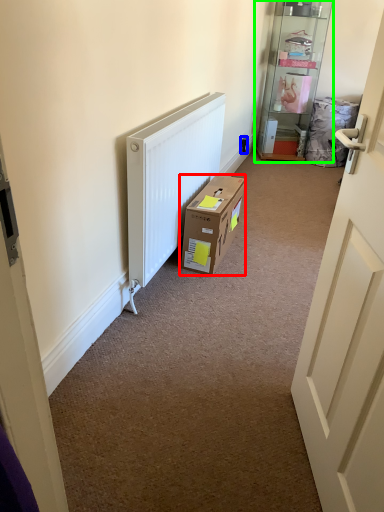
Question: Which object is the farthest from box (highlighted by a red box)? Choose among these: electric outlet (highlighted by a blue box) or shelf (highlighted by a green box).

Choices:
 (A) electric outlet
 (B) shelf

Answer: (B)